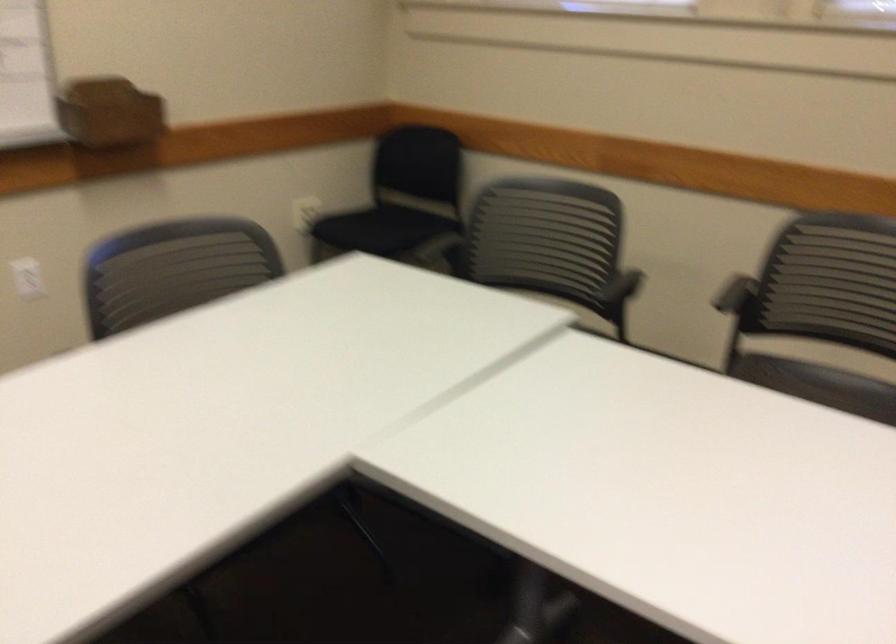
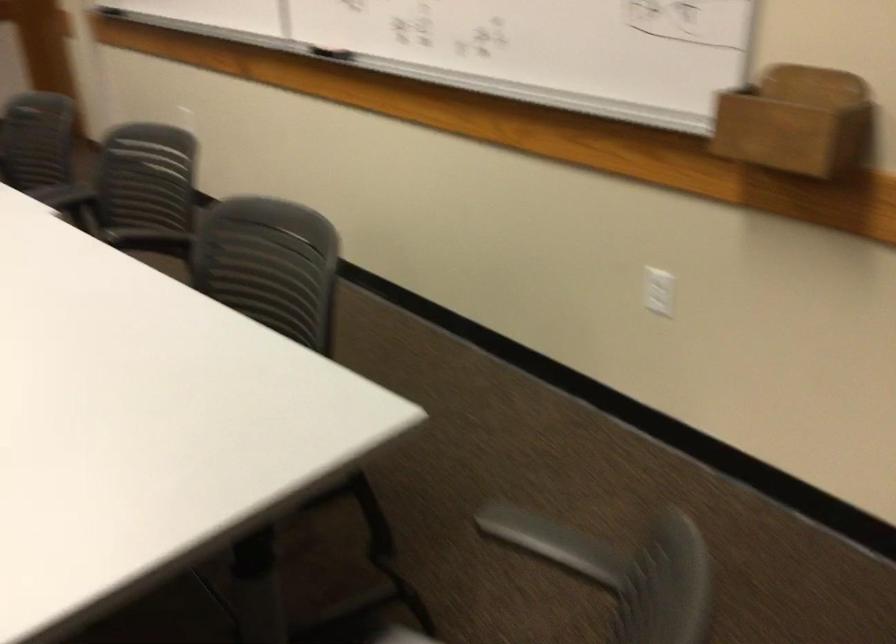
Find the pixel in the second image that matches (x=138, y=104) in the first image.

(797, 122)